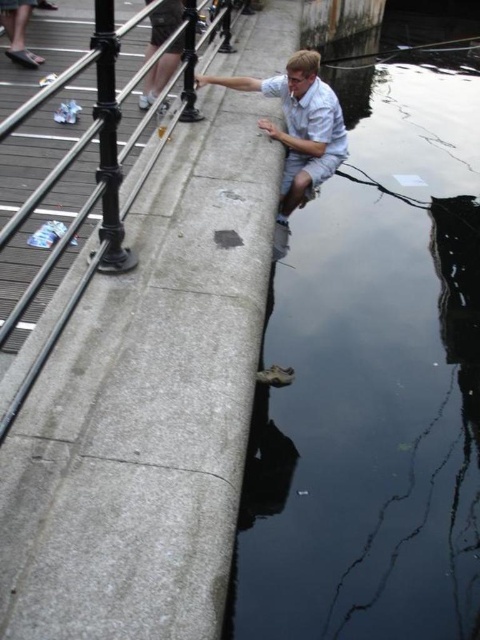
Which is below, transparent glass water at lower right or white cotton shirt at center?

transparent glass water at lower right is lower down.

Is transparent glass water at lower right positioned behind white cotton shirt at center?

That is False.

Identify the location of transparent glass water at lower right. The height and width of the screenshot is (640, 480). (373, 380).

Does transparent glass water at lower right appear on the left side of polished metal rail at upper center?

No, transparent glass water at lower right is not to the left of polished metal rail at upper center.

Between transparent glass water at lower right and polished metal rail at upper center, which one is positioned lower?

Result: polished metal rail at upper center is lower down.

The image size is (480, 640). Find the location of `transparent glass water at lower right`. transparent glass water at lower right is located at coordinates (373, 380).

Is white cotton shirt at center shorter than polished metal rail at upper center?

Incorrect, white cotton shirt at center's height does not fall short of polished metal rail at upper center's.

Is point (307, 74) positioned in front of point (41, 368)?

No, (307, 74) is behind (41, 368).

Is point (295, 88) closer to camera compared to point (70, 317)?

No, it is behind (70, 317).

Where is `white cotton shirt at center`? white cotton shirt at center is located at coordinates (299, 125).